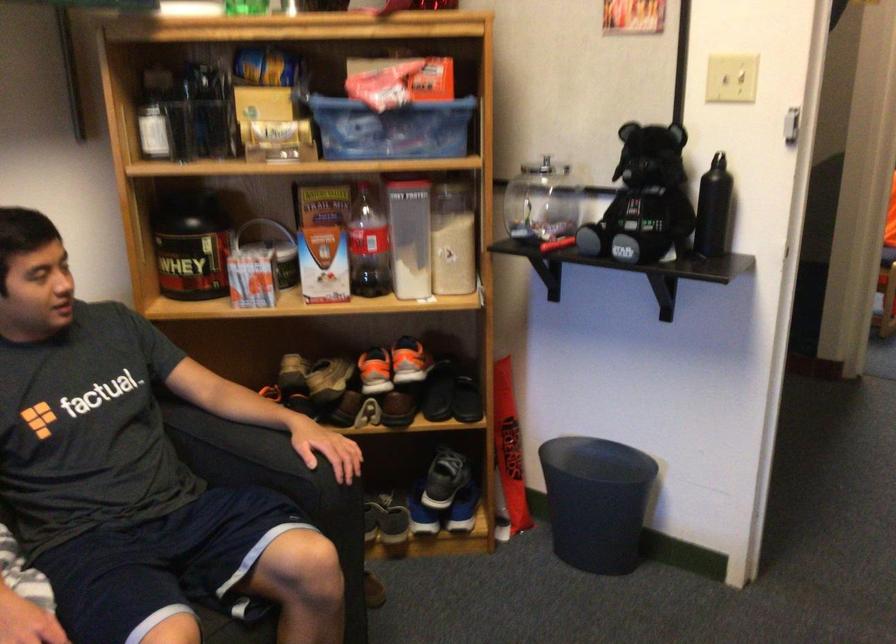
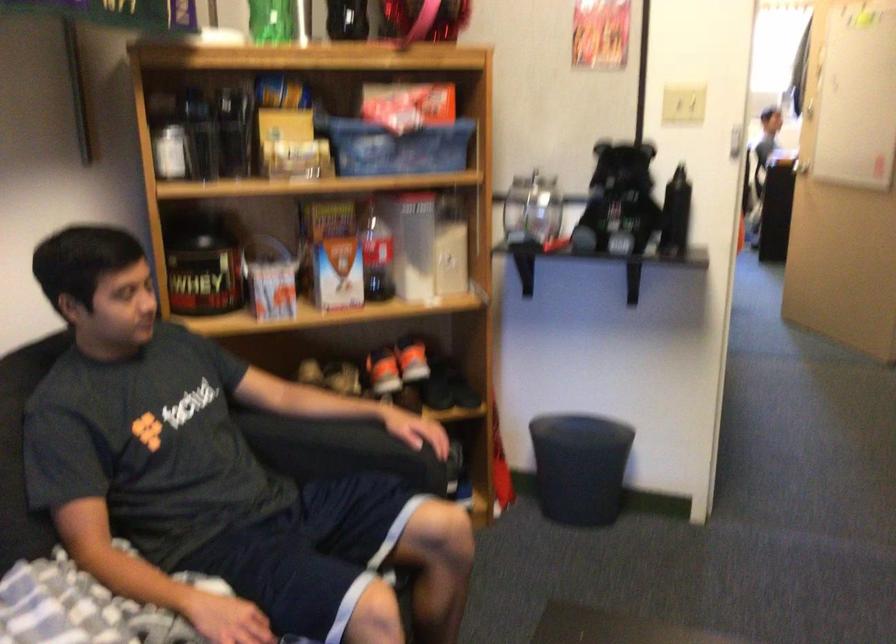
Where in the second image is the point corresponding to (366,245) from the first image?

(375, 254)